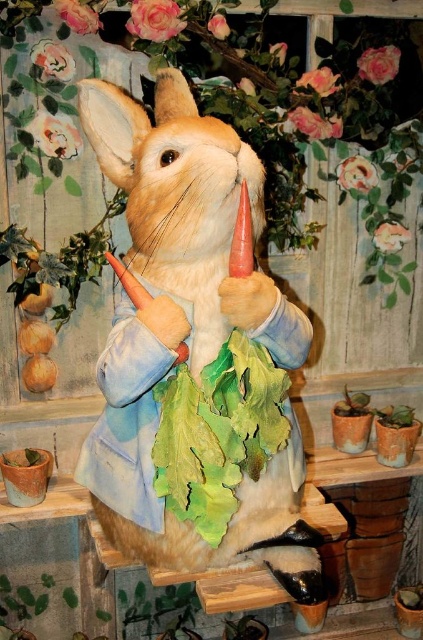
Question: Is fuzzy beige rabbit at center smaller than green leafy plant at lower center?

Choices:
 (A) no
 (B) yes

Answer: (A)

Question: Which point is closer to the camera?

Choices:
 (A) green leafy plant at lower center
 (B) fuzzy beige rabbit at center

Answer: (B)

Question: Which point appears closest to the camera in this image?

Choices:
 (A) (238, 330)
 (B) (227, 620)

Answer: (A)

Question: Can you confirm if fuzzy beige rabbit at center is thinner than green leafy plant at lower center?

Choices:
 (A) yes
 (B) no

Answer: (B)

Question: Among these points, which one is farthest from the camera?

Choices:
 (A) (123, 164)
 (B) (252, 630)

Answer: (B)

Question: Does fuzzy beige rabbit at center have a lesser width compared to green leafy plant at lower center?

Choices:
 (A) yes
 (B) no

Answer: (B)